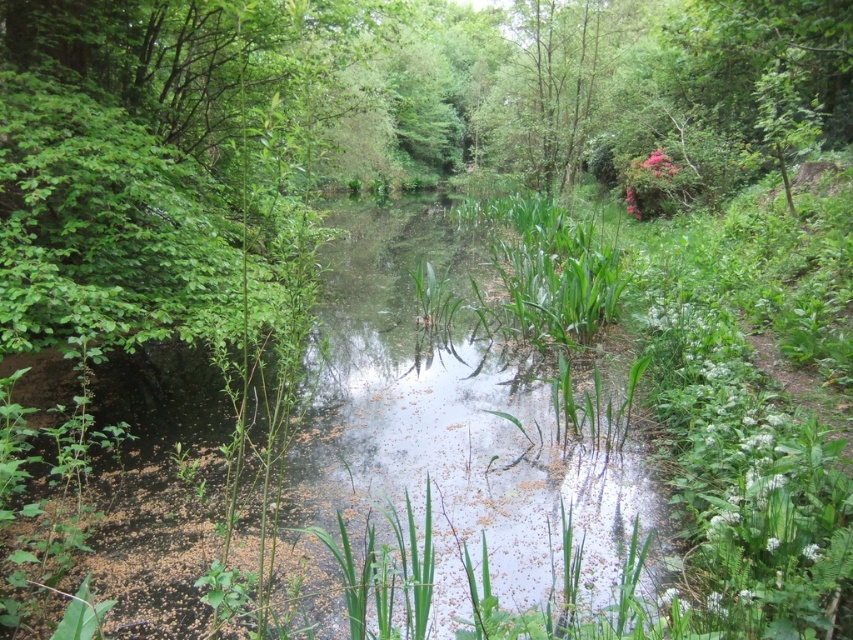
Question: Which of the following is the closest to the observer?

Choices:
 (A) green leafy tree at upper center
 (B) green leafy water at center

Answer: (B)

Question: Does green leafy water at center have a smaller size compared to green leafy tree at upper center?

Choices:
 (A) yes
 (B) no

Answer: (A)

Question: Is green leafy water at center below green leafy tree at upper center?

Choices:
 (A) no
 (B) yes

Answer: (B)

Question: Which point is closer to the camera?

Choices:
 (A) (575, 35)
 (B) (639, 468)

Answer: (B)

Question: Can you confirm if green leafy water at center is positioned to the left of green leafy tree at upper center?

Choices:
 (A) no
 (B) yes

Answer: (B)

Question: Among these objects, which one is nearest to the camera?

Choices:
 (A) green leafy water at center
 (B) green leafy tree at upper center

Answer: (A)